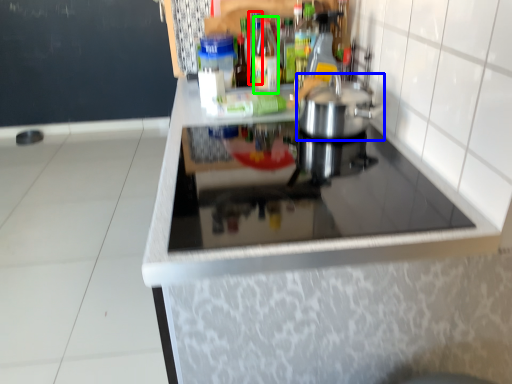
Question: Which is nearer to the bottle (highlighted by a red box)? kitchen appliance (highlighted by a blue box) or bottle (highlighted by a green box).

Choices:
 (A) kitchen appliance
 (B) bottle

Answer: (B)